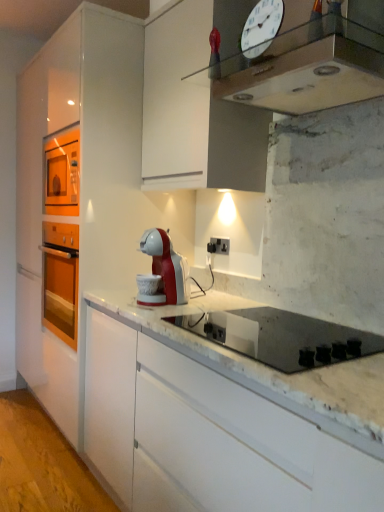
Question: Is white glass clock at upper center facing away from metallic silver clock at upper center?

Choices:
 (A) yes
 (B) no

Answer: (A)

Question: Is metallic silver clock at upper center surrounded by white glass clock at upper center?

Choices:
 (A) no
 (B) yes

Answer: (A)

Question: Considering the relative positions of white glass clock at upper center and metallic silver clock at upper center in the image provided, is white glass clock at upper center to the right of metallic silver clock at upper center from the viewer's perspective?

Choices:
 (A) yes
 (B) no

Answer: (B)

Question: Can you confirm if white glass clock at upper center is taller than metallic silver clock at upper center?

Choices:
 (A) yes
 (B) no

Answer: (A)

Question: From a real-world perspective, is white glass clock at upper center physically below metallic silver clock at upper center?

Choices:
 (A) no
 (B) yes

Answer: (A)

Question: Is white glass clock at upper center aimed at metallic silver clock at upper center?

Choices:
 (A) no
 (B) yes

Answer: (A)

Question: Considering the relative sizes of black plastic electric outlet at center and white glass clock at upper center in the image provided, is black plastic electric outlet at center wider than white glass clock at upper center?

Choices:
 (A) yes
 (B) no

Answer: (A)

Question: Does black plastic electric outlet at center have a greater height compared to white glass clock at upper center?

Choices:
 (A) yes
 (B) no

Answer: (B)

Question: Can you confirm if black plastic electric outlet at center is smaller than white glass clock at upper center?

Choices:
 (A) no
 (B) yes

Answer: (B)

Question: From a real-world perspective, is black plastic electric outlet at center below white glass clock at upper center?

Choices:
 (A) yes
 (B) no

Answer: (A)

Question: Is black plastic electric outlet at center oriented towards white glass clock at upper center?

Choices:
 (A) yes
 (B) no

Answer: (B)

Question: Can you confirm if black plastic electric outlet at center is shorter than white glass clock at upper center?

Choices:
 (A) yes
 (B) no

Answer: (A)

Question: Would you consider black glass gas stove at center to be distant from black plastic electric outlet at center?

Choices:
 (A) yes
 (B) no

Answer: (B)